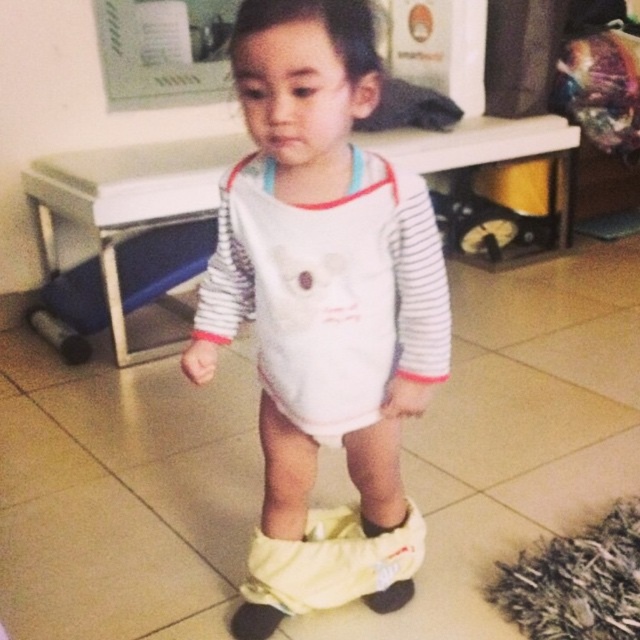
You are a photographer setting up for a photo shoot in the room. You need to position two markers at the coordinates point (248, 173) and point (348, 429). Which marker should you place first if you want to start with the one closer to the camera?

You should place the marker at point (248, 173) first because it is closer to the viewer than point (348, 429).

You are a parent trying to put socks on your child. You have two options available in the image, the yellow fabric sock at lower center and the white soft sock at lower center. Which sock would you choose if you want the one that is wider?

The yellow fabric sock at lower center might be wider than the white soft sock at lower center, so you should choose the yellow fabric sock at lower center if you want the wider one.

You are a parent preparing to dress your child. You have a white soft onesie at center and a white soft bib at center. Which item should you put on first based on their sizes?

The white soft onesie at center has a larger size compared to the white soft bib at center, so you should put on the white soft onesie at center first to ensure proper placement of the smaller bib afterward.